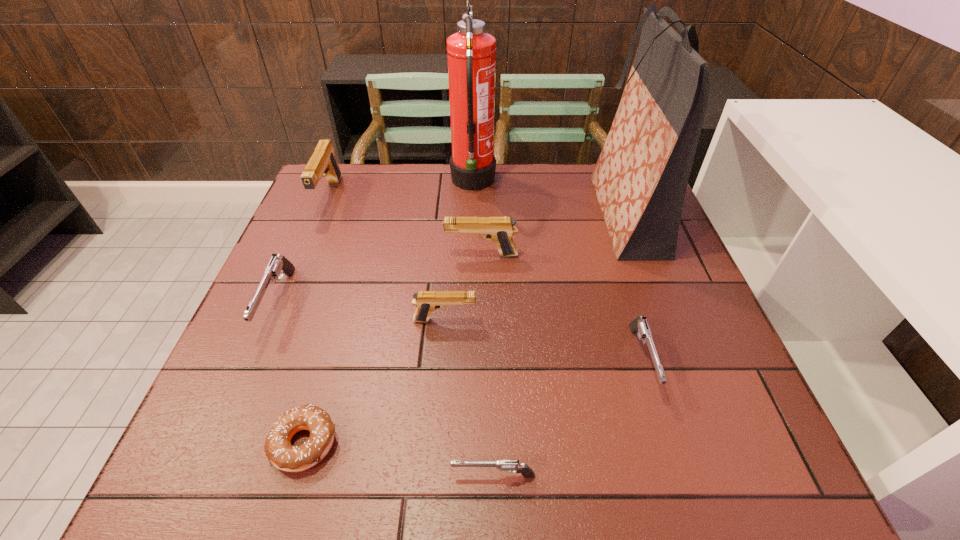
The width and height of the screenshot is (960, 540). I want to click on vacant space situated at the barrel of the fourth tallest object, so click(372, 255).

Locate an element on the screen. This screenshot has width=960, height=540. vacant space located at the barrel of the fourth tallest object is located at coordinates (385, 255).

Find the location of a particular element. vacant space situated on the front-facing side of the leftmost silver pistol is located at coordinates (244, 382).

Locate an element on the screen. vacant space situated 0.050m at the barrel of the smallest tan pistol is located at coordinates (499, 320).

The image size is (960, 540). What are the coordinates of `vacant area situated on the front-facing side of the second shortest pistol` in the screenshot? It's located at (679, 479).

The height and width of the screenshot is (540, 960). Identify the location of free space located on the front-facing side of the nearest pistol. (274, 476).

The image size is (960, 540). I want to click on free space located on the front-facing side of the nearest pistol, so click(206, 476).

Locate an element on the screen. The image size is (960, 540). vacant space located 0.230m on the front-facing side of the nearest pistol is located at coordinates (311, 476).

The image size is (960, 540). I want to click on free point located on the back of the third object from left to right, so click(349, 288).

Image resolution: width=960 pixels, height=540 pixels. Identify the location of fire extinguisher situated at the far edge. (471, 52).